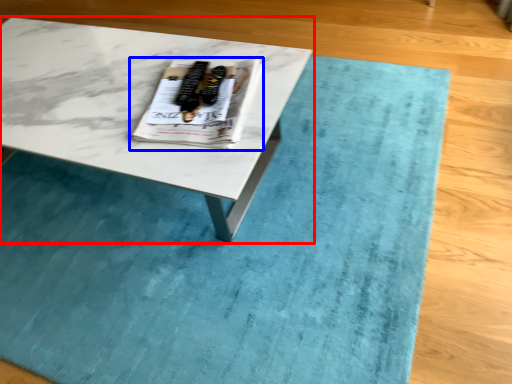
Question: Which object appears farthest to the camera in this image, coffee table (highlighted by a red box) or magazine (highlighted by a blue box)?

Choices:
 (A) coffee table
 (B) magazine

Answer: (B)